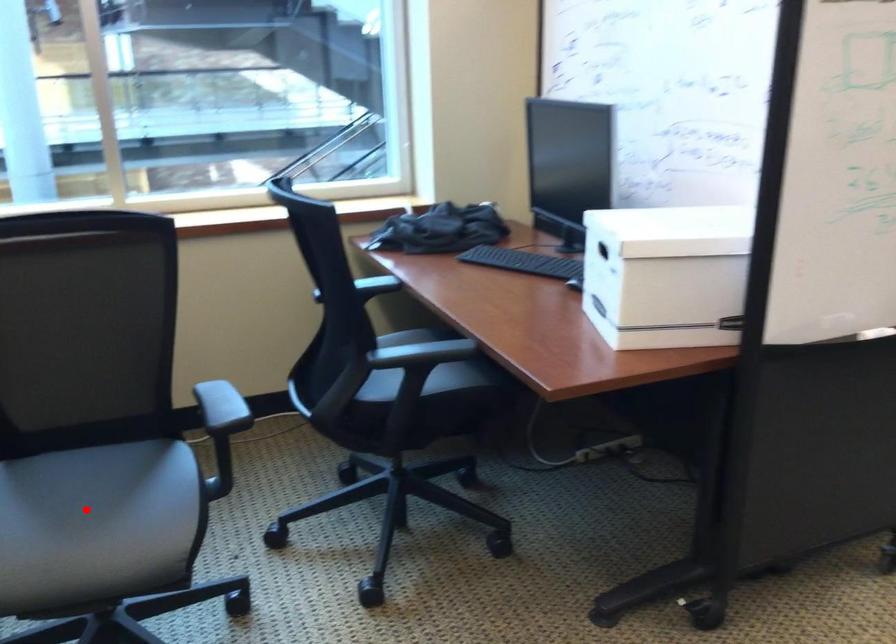
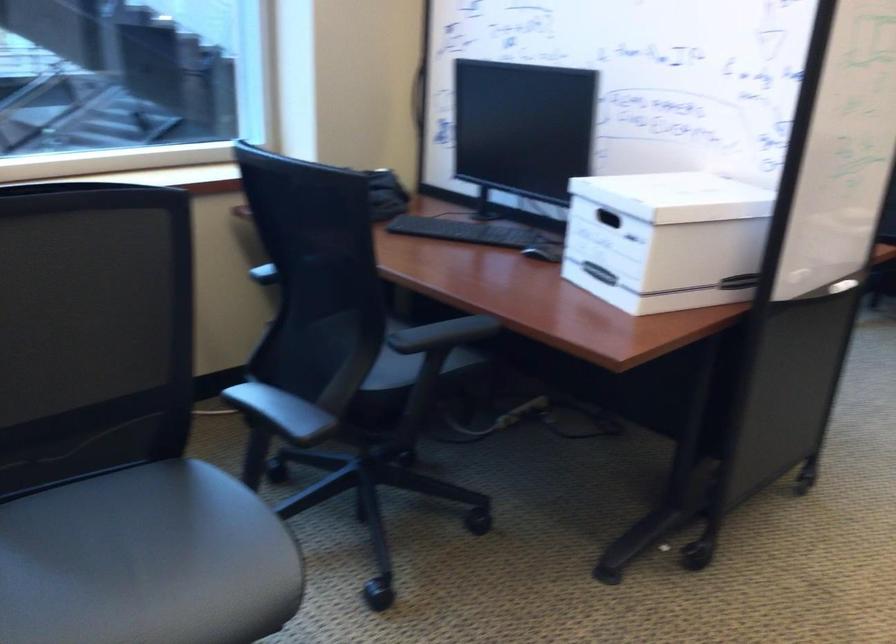
Locate, in the second image, the point that corresponds to the highlighted location in the first image.

(145, 561)